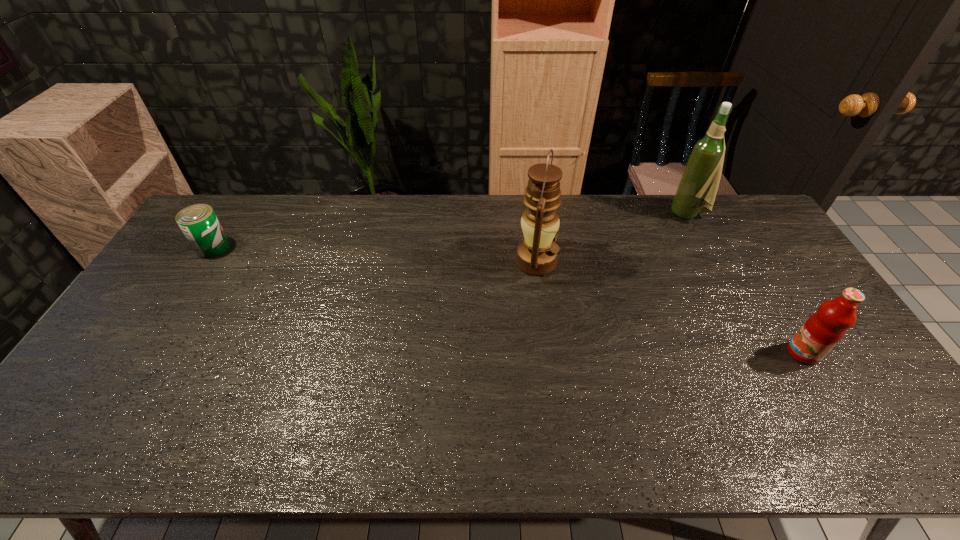
Where is `wine bottle`? This screenshot has height=540, width=960. wine bottle is located at coordinates (700, 180).

You are a GUI agent. You are given a task and a screenshot of the screen. Output one action in this format:
    pyautogui.click(x=<x>, y=<y>)
    Task: Click on the farthest object
    The height and width of the screenshot is (540, 960).
    Given the screenshot: What is the action you would take?
    pyautogui.click(x=700, y=180)

Locate an element on the screen. This screenshot has width=960, height=540. the second object from left to right is located at coordinates (536, 255).

Identify the location of the second shortest object. (824, 329).

You are a GUI agent. You are given a task and a screenshot of the screen. Output one action in this format:
    pyautogui.click(x=<x>, y=<y>)
    Task: Click on the rightmost object
    This screenshot has height=540, width=960.
    Given the screenshot: What is the action you would take?
    pyautogui.click(x=824, y=329)

Where is `can`? This screenshot has width=960, height=540. can is located at coordinates point(198,222).

Locate an element on the screen. The image size is (960, 540). the shortest object is located at coordinates (198, 222).

Where is `vacant space located 0.300m on the front-facing side of the farthest object`? The height and width of the screenshot is (540, 960). vacant space located 0.300m on the front-facing side of the farthest object is located at coordinates (587, 214).

Locate an element on the screen. The width and height of the screenshot is (960, 540). blank space located on the front-facing side of the farthest object is located at coordinates (642, 214).

Identify the location of free location located on the front-facing side of the farthest object. (620, 214).